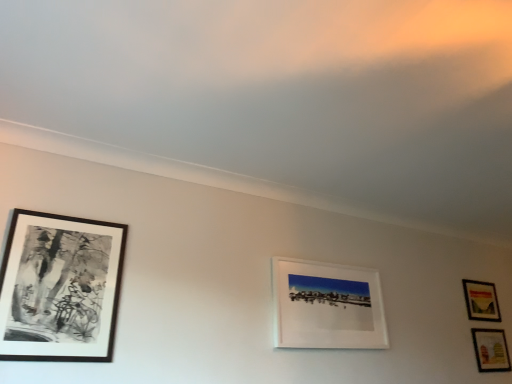
The height and width of the screenshot is (384, 512). I want to click on white matte picture frame at center, which is the 3th picture frame from right to left, so click(x=327, y=306).

You are a GUI agent. You are given a task and a screenshot of the screen. Output one action in this format:
    pyautogui.click(x=<x>, y=<y>)
    Task: Click on the matte wooden picture frame at lower right, which is counted as the second picture frame, starting from the back
    
    Given the screenshot: What is the action you would take?
    pyautogui.click(x=490, y=350)

Measure the distance between point (493, 340) and camera.

They are 3.22 meters apart.

Identify the location of matte wooden picture frame at right, the 1th picture frame when ordered from back to front. (481, 300).

The image size is (512, 384). Describe the element at coordinates (481, 300) in the screenshot. I see `matte wooden picture frame at right, placed as the second picture frame when sorted from right to left` at that location.

The image size is (512, 384). Find the location of `white matte picture frame at center, which is the second picture frame in left-to-right order`. white matte picture frame at center, which is the second picture frame in left-to-right order is located at coordinates (327, 306).

Are matte wooden picture frame at lower right, marked as the 1th picture frame in a right-to-left arrangement, and matte wooden picture frame at right, the 3th picture frame when ordered from left to right, located far from each other?

No, matte wooden picture frame at lower right, marked as the 1th picture frame in a right-to-left arrangement, is in close proximity to matte wooden picture frame at right, the 3th picture frame when ordered from left to right.

Measure the distance between matte wooden picture frame at lower right, arranged as the 4th picture frame when viewed from the left, and matte wooden picture frame at right, the 1th picture frame when ordered from back to front.

They are 8.94 inches apart.

Is matte wooden picture frame at right, the 3th picture frame when ordered from left to right, at the back of matte wooden picture frame at lower right, marked as the third picture frame in a front-to-back arrangement?

No, matte wooden picture frame at lower right, marked as the third picture frame in a front-to-back arrangement, is not facing the opposite direction of matte wooden picture frame at right, the 3th picture frame when ordered from left to right.

In the image, is matte wooden picture frame at lower right, which is counted as the second picture frame, starting from the back, on the left side or the right side of matte wooden picture frame at right, placed as the second picture frame when sorted from right to left?

From the image, it's evident that matte wooden picture frame at lower right, which is counted as the second picture frame, starting from the back, is to the right of matte wooden picture frame at right, placed as the second picture frame when sorted from right to left.

Are white matte picture frame at center, which is the second picture frame in left-to-right order, and matte wooden picture frame at right, the 1th picture frame when ordered from back to front, making contact?

No.

Who is more distant, white matte picture frame at center, which is the second picture frame in left-to-right order, or matte wooden picture frame at right, the 4th picture frame viewed from the front?

matte wooden picture frame at right, the 4th picture frame viewed from the front, is behind.

Looking at their sizes, would you say white matte picture frame at center, arranged as the third picture frame when viewed from the back, is wider or thinner than matte wooden picture frame at right, the 1th picture frame when ordered from back to front?

Clearly, white matte picture frame at center, arranged as the third picture frame when viewed from the back, has more width compared to matte wooden picture frame at right, the 1th picture frame when ordered from back to front.

From a real-world perspective, is white matte picture frame at center, which is the 3th picture frame from right to left, located higher than matte wooden picture frame at right, placed as the second picture frame when sorted from right to left?

No, from a real-world perspective, white matte picture frame at center, which is the 3th picture frame from right to left, is not above matte wooden picture frame at right, placed as the second picture frame when sorted from right to left.

Does white matte picture frame at center, arranged as the third picture frame when viewed from the back, turn towards matte wooden picture frame at lower right, arranged as the 4th picture frame when viewed from the left?

No, white matte picture frame at center, arranged as the third picture frame when viewed from the back, does not turn towards matte wooden picture frame at lower right, arranged as the 4th picture frame when viewed from the left.

Is white matte picture frame at center, which is the second picture frame in left-to-right order, further to the viewer compared to matte wooden picture frame at lower right, marked as the 1th picture frame in a right-to-left arrangement?

No, it is not.

Is white matte picture frame at center, which is the second picture frame in left-to-right order, positioned beyond the bounds of matte wooden picture frame at lower right, marked as the 1th picture frame in a right-to-left arrangement?

Yes.

Is white matte picture frame at center, which is the 3th picture frame from right to left, shorter than matte wooden picture frame at lower right, which is counted as the second picture frame, starting from the back?

No.

Is black matte picture frame at left, which is the fourth picture frame in back-to-front order, to the right of matte wooden picture frame at lower right, arranged as the 4th picture frame when viewed from the left, from the viewer's perspective?

No, black matte picture frame at left, which is the fourth picture frame in back-to-front order, is not to the right of matte wooden picture frame at lower right, arranged as the 4th picture frame when viewed from the left.

Based on the photo, could matte wooden picture frame at lower right, marked as the 1th picture frame in a right-to-left arrangement, be considered to be inside black matte picture frame at left, positioned as the 1th picture frame in front-to-back order?

No, matte wooden picture frame at lower right, marked as the 1th picture frame in a right-to-left arrangement, is located outside of black matte picture frame at left, positioned as the 1th picture frame in front-to-back order.

Could you tell me if black matte picture frame at left, which is the first picture frame from left to right, is turned towards matte wooden picture frame at lower right, arranged as the 4th picture frame when viewed from the left?

No, black matte picture frame at left, which is the first picture frame from left to right, is not aimed at matte wooden picture frame at lower right, arranged as the 4th picture frame when viewed from the left.

Could you tell me if matte wooden picture frame at lower right, marked as the 1th picture frame in a right-to-left arrangement, is turned towards black matte picture frame at left, which is the first picture frame from left to right?

No, matte wooden picture frame at lower right, marked as the 1th picture frame in a right-to-left arrangement, is not oriented towards black matte picture frame at left, which is the first picture frame from left to right.

From the picture: Does matte wooden picture frame at lower right, which is counted as the second picture frame, starting from the back, have a greater height compared to black matte picture frame at left, which is the first picture frame from left to right?

In fact, matte wooden picture frame at lower right, which is counted as the second picture frame, starting from the back, may be shorter than black matte picture frame at left, which is the first picture frame from left to right.

Based on their positions, is matte wooden picture frame at lower right, marked as the third picture frame in a front-to-back arrangement, located to the left or right of black matte picture frame at left, positioned as the 1th picture frame in front-to-back order?

Clearly, matte wooden picture frame at lower right, marked as the third picture frame in a front-to-back arrangement, is on the right of black matte picture frame at left, positioned as the 1th picture frame in front-to-back order, in the image.

From the image's perspective, does black matte picture frame at left, which is the first picture frame from left to right, appear higher than white matte picture frame at center, which is the second picture frame in left-to-right order?

Yes, from the image's perspective, black matte picture frame at left, which is the first picture frame from left to right, is on top of white matte picture frame at center, which is the second picture frame in left-to-right order.

From a real-world perspective, which object rests below the other?

In real-world perspective, black matte picture frame at left, the 4th picture frame viewed from the right, is lower.

Is black matte picture frame at left, which is the first picture frame from left to right, positioned with its back to white matte picture frame at center, which is the 3th picture frame from right to left?

That's not correct — black matte picture frame at left, which is the first picture frame from left to right, is not looking away from white matte picture frame at center, which is the 3th picture frame from right to left.

From a real-world perspective, who is located lower, white matte picture frame at center, which ranks as the 2th picture frame in front-to-back order, or black matte picture frame at left, positioned as the 1th picture frame in front-to-back order?

From a 3D spatial view, black matte picture frame at left, positioned as the 1th picture frame in front-to-back order, is below.

Based on the photo, which object is more forward, white matte picture frame at center, arranged as the third picture frame when viewed from the back, or black matte picture frame at left, the 4th picture frame viewed from the right?

black matte picture frame at left, the 4th picture frame viewed from the right, is closer to the camera.

Which is more to the right, white matte picture frame at center, which ranks as the 2th picture frame in front-to-back order, or black matte picture frame at left, which is the first picture frame from left to right?

white matte picture frame at center, which ranks as the 2th picture frame in front-to-back order, is more to the right.

Do you think white matte picture frame at center, arranged as the third picture frame when viewed from the back, is within black matte picture frame at left, which is the first picture frame from left to right, or outside of it?

white matte picture frame at center, arranged as the third picture frame when viewed from the back, is not enclosed by black matte picture frame at left, which is the first picture frame from left to right.

Image resolution: width=512 pixels, height=384 pixels. In order to click on the 3rd picture frame below the matte wooden picture frame at right, the 1th picture frame when ordered from back to front (from a real-world perspective) in this screenshot , I will do `click(490, 350)`.

What are the coordinates of `the 1st picture frame below the white matte picture frame at center, which is the 3th picture frame from right to left (from the image's perspective)` in the screenshot? It's located at (481, 300).

When comparing their distances from white matte picture frame at center, which ranks as the 2th picture frame in front-to-back order, does black matte picture frame at left, positioned as the 1th picture frame in front-to-back order, or matte wooden picture frame at lower right, arranged as the 4th picture frame when viewed from the left, seem closer?

The object closer to white matte picture frame at center, which ranks as the 2th picture frame in front-to-back order, is black matte picture frame at left, positioned as the 1th picture frame in front-to-back order.

Considering their positions, is white matte picture frame at center, which ranks as the 2th picture frame in front-to-back order, positioned further to black matte picture frame at left, which is the first picture frame from left to right, than matte wooden picture frame at lower right, arranged as the 4th picture frame when viewed from the left?

A: The object further to black matte picture frame at left, which is the first picture frame from left to right, is matte wooden picture frame at lower right, arranged as the 4th picture frame when viewed from the left.

When comparing their distances from black matte picture frame at left, the 4th picture frame viewed from the right, does white matte picture frame at center, which is the 3th picture frame from right to left, or matte wooden picture frame at right, the 3th picture frame when ordered from left to right, seem closer?

The object closer to black matte picture frame at left, the 4th picture frame viewed from the right, is white matte picture frame at center, which is the 3th picture frame from right to left.

Looking at the image, which one is located further to white matte picture frame at center, arranged as the third picture frame when viewed from the back, matte wooden picture frame at lower right, which is counted as the second picture frame, starting from the back, or matte wooden picture frame at right, the 1th picture frame when ordered from back to front?

Among the two, matte wooden picture frame at lower right, which is counted as the second picture frame, starting from the back, is located further to white matte picture frame at center, arranged as the third picture frame when viewed from the back.

Considering their positions, is white matte picture frame at center, arranged as the third picture frame when viewed from the back, positioned further to matte wooden picture frame at right, the 4th picture frame viewed from the front, than black matte picture frame at left, which is the fourth picture frame in back-to-front order?

black matte picture frame at left, which is the fourth picture frame in back-to-front order, lies further to matte wooden picture frame at right, the 4th picture frame viewed from the front, than the other object.

Based on their spatial positions, is matte wooden picture frame at right, the 3th picture frame when ordered from left to right, or white matte picture frame at center, which is the 3th picture frame from right to left, closer to matte wooden picture frame at lower right, arranged as the 4th picture frame when viewed from the left?

Among the two, matte wooden picture frame at right, the 3th picture frame when ordered from left to right, is located nearer to matte wooden picture frame at lower right, arranged as the 4th picture frame when viewed from the left.

Estimate the real-world distances between objects in this image. Which object is further from matte wooden picture frame at lower right, arranged as the 4th picture frame when viewed from the left, white matte picture frame at center, which is the 3th picture frame from right to left, or matte wooden picture frame at right, placed as the second picture frame when sorted from right to left?

white matte picture frame at center, which is the 3th picture frame from right to left.

Considering their positions, is matte wooden picture frame at lower right, marked as the 1th picture frame in a right-to-left arrangement, positioned further to white matte picture frame at center, which ranks as the 2th picture frame in front-to-back order, than black matte picture frame at left, which is the first picture frame from left to right?

matte wooden picture frame at lower right, marked as the 1th picture frame in a right-to-left arrangement.

At what (x,y) coordinates should I click in order to perform the action: click on picture frame between white matte picture frame at center, which ranks as the 2th picture frame in front-to-back order, and matte wooden picture frame at lower right, arranged as the 4th picture frame when viewed from the left, in the horizontal direction. Please return your answer as a coordinate pair (x, y). Image resolution: width=512 pixels, height=384 pixels. Looking at the image, I should click on (481, 300).

Where is `picture frame between black matte picture frame at left, which is the fourth picture frame in back-to-front order, and matte wooden picture frame at right, the 4th picture frame viewed from the front, in the horizontal direction`? Image resolution: width=512 pixels, height=384 pixels. picture frame between black matte picture frame at left, which is the fourth picture frame in back-to-front order, and matte wooden picture frame at right, the 4th picture frame viewed from the front, in the horizontal direction is located at coordinates (327, 306).